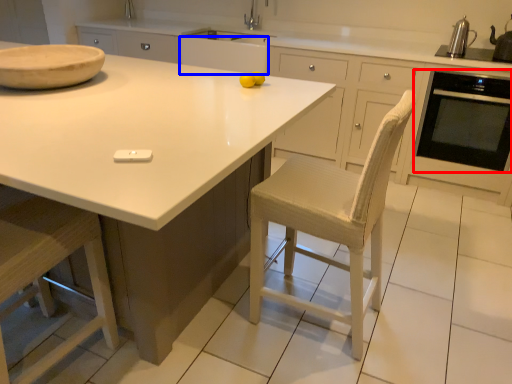
Question: Which object appears farthest to the camera in this image, home appliance (highlighted by a red box) or cabinetry (highlighted by a blue box)?

Choices:
 (A) home appliance
 (B) cabinetry

Answer: (B)